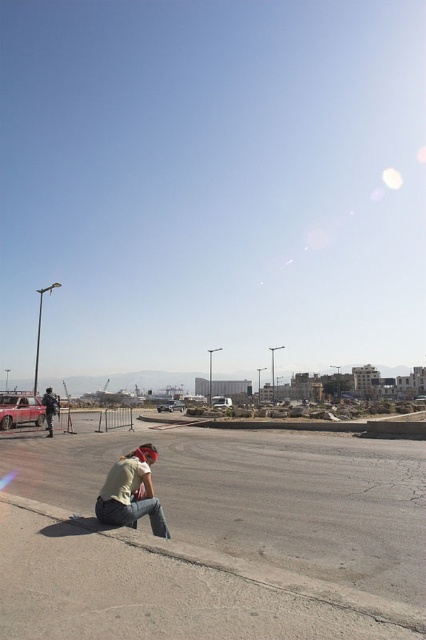
You are a delivery driver who needs to load a large package into the back of the metallic silver truck at center. The package is 1.5 meters wide. Can the matte black jacket at lower left be placed alongside the package without exceeding the truck bed width?

The matte black jacket at lower left is narrower than the metallic silver truck at center. Since the jacket is smaller in width, it can be placed alongside the 1.5m package as long as their combined width does not exceed the truck bed width. However, the exact feasibility depends on the truck bed width, which isn not specified in the scene description.

Consider the image. You are a delivery person who needs to cross the road quickly. The smooth concrete pavement at lower left and the metallic silver truck at center are in your path. Which object is closer to you as you start moving forward?

The smooth concrete pavement at lower left is closer to you because it is in front of the metallic silver truck at center.

You are a delivery driver who needs to park your metallic silver truck at center on the smooth concrete pavement at lower left. Is there enough space for the truck to park there?

The smooth concrete pavement at lower left is above the metallic silver truck at center, which means the truck is already parked on the pavement. Therefore, there is sufficient space for the truck to park there.